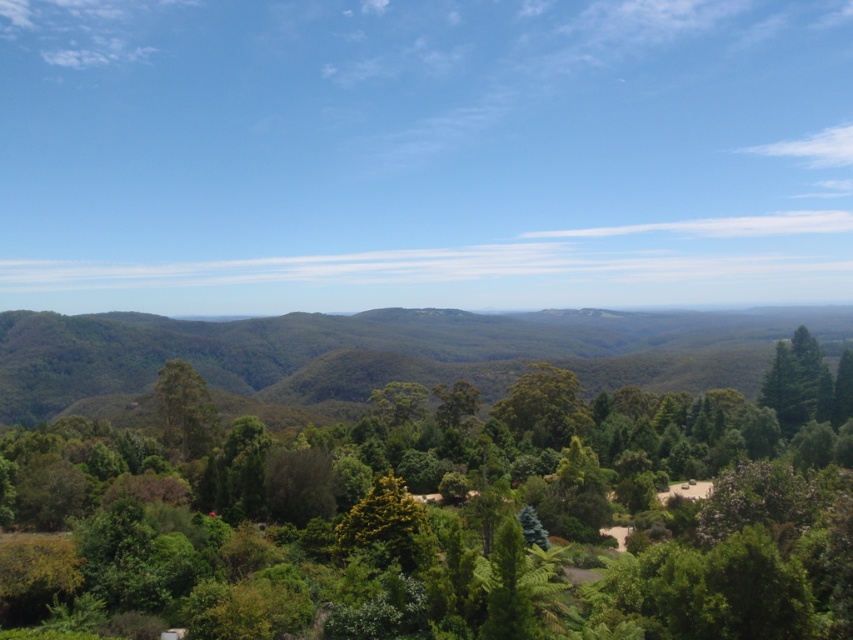
What are the coordinates of `green leafy tree at center` in the screenshot? It's located at (457, 515).

Which is in front, point (766, 627) or point (164, 385)?

Point (766, 627) is in front.

Is point (674, 513) closer to viewer compared to point (196, 394)?

Yes, point (674, 513) is in front of point (196, 394).

The height and width of the screenshot is (640, 853). In order to click on green leafy tree at center in this screenshot , I will do `click(457, 515)`.

Can you confirm if green leafy forest at left is positioned below green leafy tree at left?

Yes, green leafy forest at left is below green leafy tree at left.

Is green leafy forest at left above green leafy tree at left?

Incorrect, green leafy forest at left is not positioned above green leafy tree at left.

Which is behind, point (570, 321) or point (184, 435)?

Positioned behind is point (570, 321).

The width and height of the screenshot is (853, 640). In order to click on green leafy forest at left in this screenshot , I will do `click(392, 352)`.

Between green leafy tree at center and green leafy forest at left, which one is positioned lower?

green leafy forest at left is below.

Between point (683, 600) and point (817, 330), which one is positioned behind?

The point (817, 330) is more distant.

This screenshot has height=640, width=853. I want to click on green leafy tree at center, so click(457, 515).